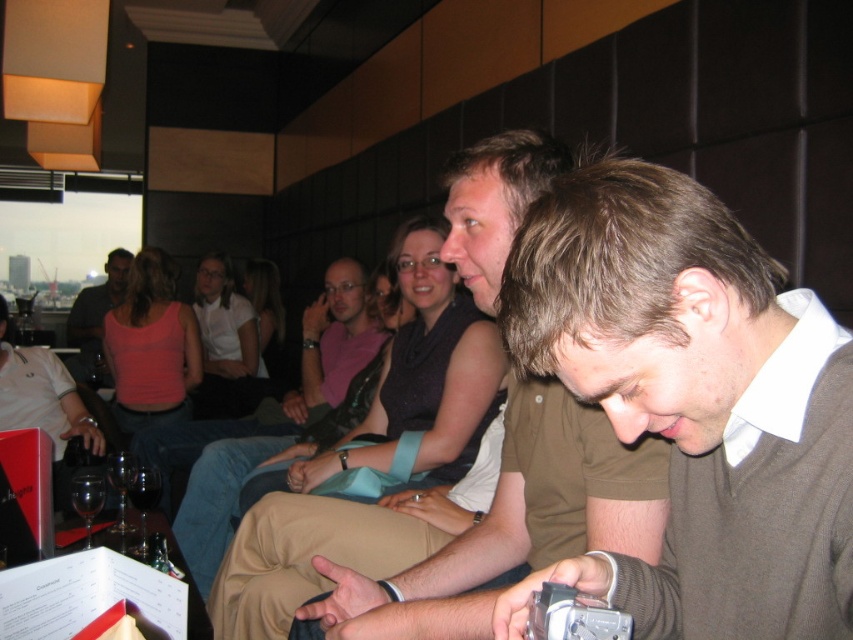
Question: Which point is closer to the camera?

Choices:
 (A) transparent glass at lower left
 (B) matte black shirt at upper center
 (C) matte black wine glass at left
 (D) brown textured shirt at center

Answer: (D)

Question: Which of these objects is positioned farthest from the clear glass wine glass at lower left?

Choices:
 (A) brown textured shirt at center
 (B) transparent glass wine glass at lower left
 (C) transparent glass at lower left
 (D) pink fabric shirt at center

Answer: (A)

Question: Is the position of matte black shirt at upper center less distant than that of clear glass wine glass at lower left?

Choices:
 (A) no
 (B) yes

Answer: (A)

Question: Is matte black wine glass at left further to camera compared to transparent glass wine glass at lower left?

Choices:
 (A) no
 (B) yes

Answer: (B)

Question: Which point is closer to the camera taking this photo?

Choices:
 (A) (650, 540)
 (B) (15, 412)

Answer: (A)

Question: Is matte black shirt at upper center thinner than transparent glass wine glass at lower left?

Choices:
 (A) yes
 (B) no

Answer: (B)